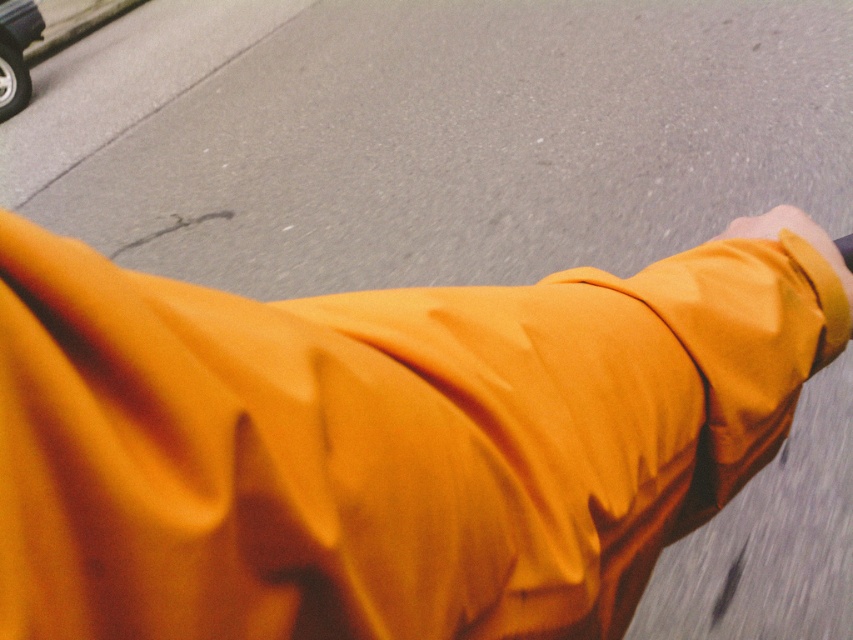
Question: Which point is farther to the camera?

Choices:
 (A) shiny silver car at upper left
 (B) matte orange robe at center

Answer: (A)

Question: Can you confirm if matte orange robe at center is wider than shiny silver car at upper left?

Choices:
 (A) yes
 (B) no

Answer: (A)

Question: In this image, where is matte orange robe at center located relative to shiny silver car at upper left?

Choices:
 (A) right
 (B) left

Answer: (A)

Question: Is matte orange robe at center above shiny silver car at upper left?

Choices:
 (A) yes
 (B) no

Answer: (B)